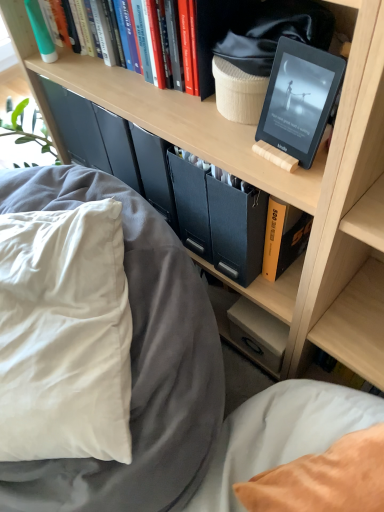
Question: Considering the relative sizes of hardcover books at upper center, the third book viewed from the right, and black matte tablet at upper right in the image provided, is hardcover books at upper center, the third book viewed from the right, bigger than black matte tablet at upper right?

Choices:
 (A) yes
 (B) no

Answer: (A)

Question: Is hardcover books at upper center, which is the first book from top to bottom, further to the viewer compared to black matte tablet at upper right?

Choices:
 (A) no
 (B) yes

Answer: (B)

Question: From the image's perspective, would you say hardcover books at upper center, the third book viewed from the right, is positioned over black matte tablet at upper right?

Choices:
 (A) no
 (B) yes

Answer: (B)

Question: From a real-world perspective, is hardcover books at upper center, which is the 4th book from bottom to top, over black matte tablet at upper right?

Choices:
 (A) no
 (B) yes

Answer: (B)

Question: Is hardcover books at upper center, which is the first book from top to bottom, directly adjacent to black matte tablet at upper right?

Choices:
 (A) no
 (B) yes

Answer: (A)

Question: From their relative heights in the image, would you say black matte tablet at upper right is taller or shorter than orange matte book at center?

Choices:
 (A) tall
 (B) short

Answer: (B)

Question: In the image, is black matte tablet at upper right positioned in front of or behind orange matte book at center?

Choices:
 (A) behind
 (B) front

Answer: (B)

Question: In terms of width, does black matte tablet at upper right look wider or thinner when compared to orange matte book at center?

Choices:
 (A) thin
 (B) wide

Answer: (A)

Question: Considering the positions of point (340, 67) and point (235, 272), is point (340, 67) closer or farther from the camera than point (235, 272)?

Choices:
 (A) farther
 (B) closer

Answer: (B)

Question: Considering the positions of hardcover books at upper center, which is the first book from top to bottom, and yellow hardcover book at center, the fourth book in the top-to-bottom sequence, in the image, is hardcover books at upper center, which is the first book from top to bottom, bigger or smaller than yellow hardcover book at center, the fourth book in the top-to-bottom sequence,?

Choices:
 (A) big
 (B) small

Answer: (A)

Question: Is hardcover books at upper center, which is the 4th book from bottom to top, wider or thinner than yellow hardcover book at center, the fourth book in the top-to-bottom sequence?

Choices:
 (A) thin
 (B) wide

Answer: (B)

Question: Relative to yellow hardcover book at center, which ranks as the 1th book in bottom-to-top order, is hardcover books at upper center, which is the first book from top to bottom, in front or behind?

Choices:
 (A) behind
 (B) front

Answer: (B)

Question: From a real-world perspective, is hardcover books at upper center, which is the 4th book from bottom to top, positioned above or below yellow hardcover book at center, which ranks as the 1th book in bottom-to-top order?

Choices:
 (A) below
 (B) above

Answer: (B)

Question: From the image's perspective, is white soft pillow at left located above or below yellow hardcover book at center, the fourth book in the top-to-bottom sequence?

Choices:
 (A) below
 (B) above

Answer: (A)

Question: Is white soft pillow at left inside the boundaries of yellow hardcover book at center, the fourth book positioned from the left, or outside?

Choices:
 (A) inside
 (B) outside

Answer: (B)